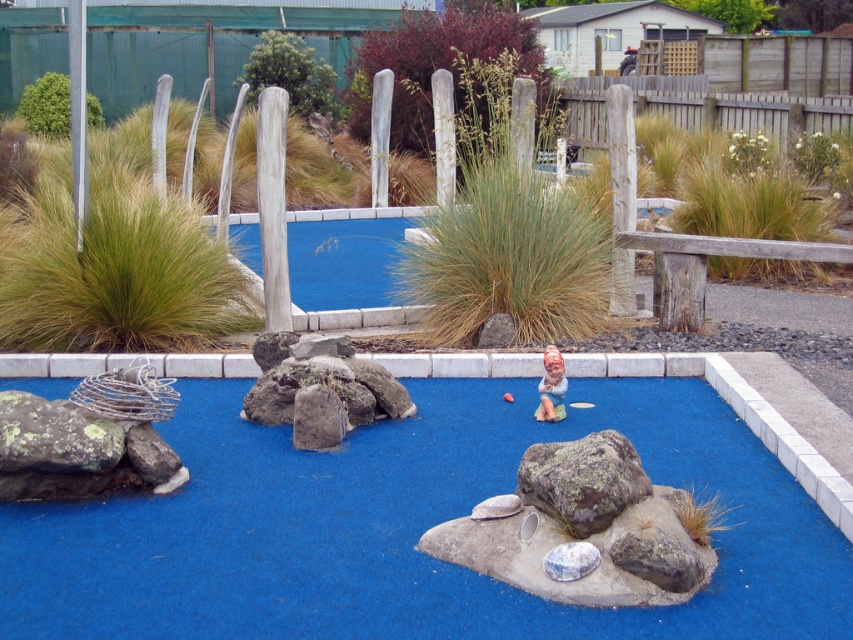
Question: Which object appears farthest from the camera in this image?

Choices:
 (A) blue rubber golf course at center
 (B) matte ceramic figurine at center
 (C) green mossy rock at center

Answer: (B)

Question: Which point is farther to the camera?

Choices:
 (A) matte ceramic figurine at center
 (B) lichen-covered rock at left
 (C) brown rough rock at center

Answer: (A)

Question: Is green mossy rock at center bigger than brown rough rock at center?

Choices:
 (A) no
 (B) yes

Answer: (B)

Question: Which object is closer to the camera taking this photo?

Choices:
 (A) green mossy rock at center
 (B) blue rubber golf course at center
 (C) brown rough rock at center
 (D) lichen-covered rock at left

Answer: (B)

Question: Can you confirm if green mossy rock at center is positioned to the right of lichen-covered rock at left?

Choices:
 (A) no
 (B) yes

Answer: (B)

Question: Is blue rubber golf course at center to the left of brown rough rock at center from the viewer's perspective?

Choices:
 (A) yes
 (B) no

Answer: (B)